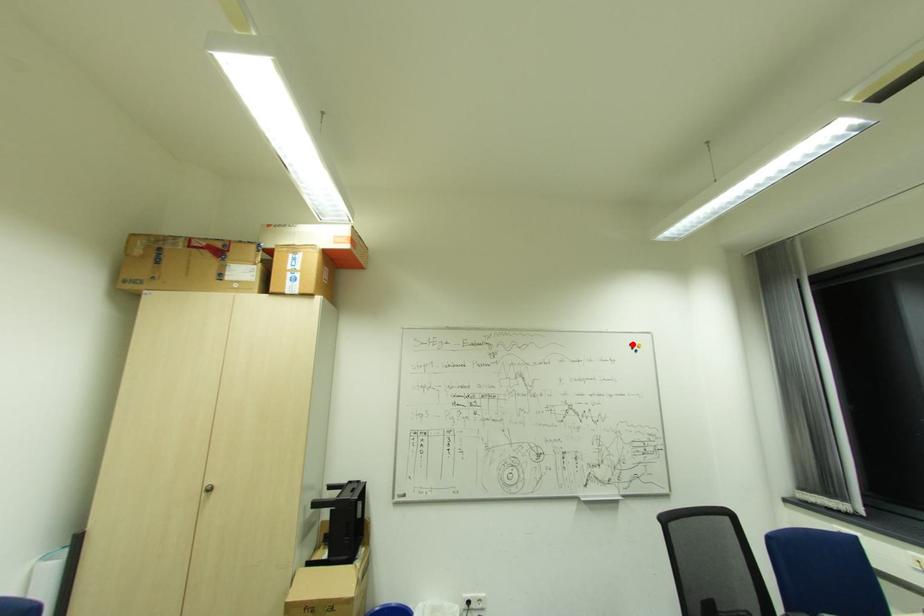
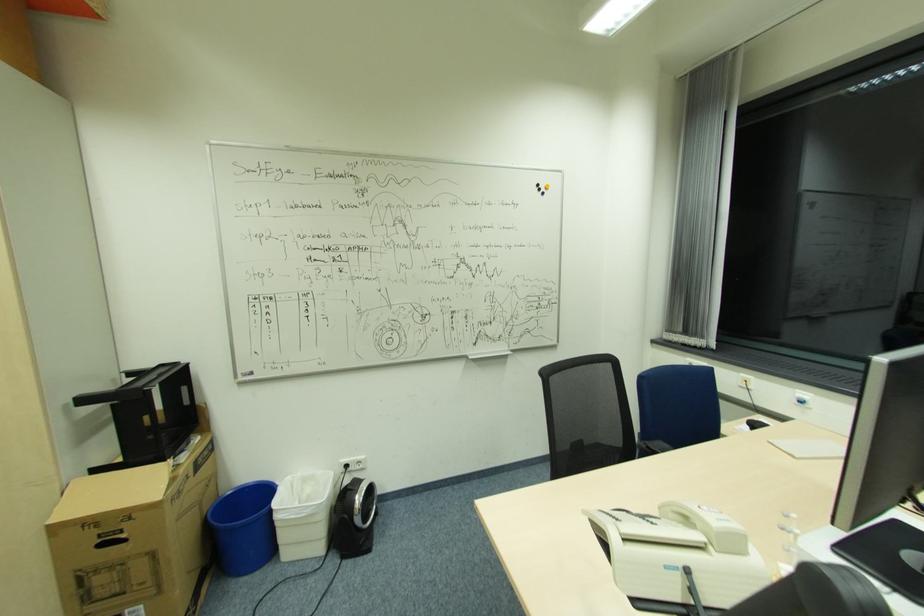
In the second image, find the point that corresponds to the highlighted location in the first image.

(541, 185)